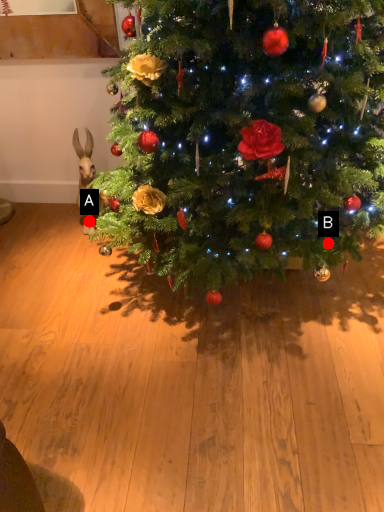
Question: Two points are circled on the image, labeled by A and B beside each circle. Which point is closer to the camera taking this photo?

Choices:
 (A) A is closer
 (B) B is closer

Answer: (B)